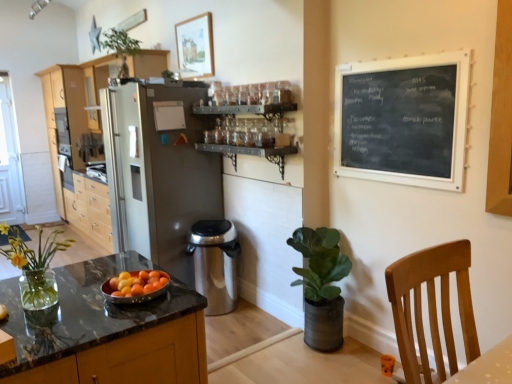
You are a GUI agent. You are given a task and a screenshot of the screen. Output one action in this format:
    pyautogui.click(x=<x>, y=<y>)
    Task: Click on the blank space above marble countertop at lower left (from a real-world perspective)
    The width and height of the screenshot is (512, 384).
    Given the screenshot: What is the action you would take?
    pyautogui.click(x=79, y=298)